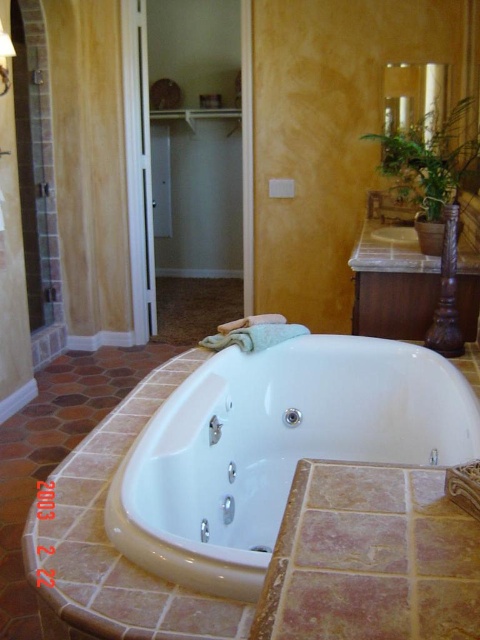
Does white glossy bathtub at center have a larger size compared to white glossy sink at center?

Yes, white glossy bathtub at center is bigger than white glossy sink at center.

Can you confirm if white glossy bathtub at center is positioned to the right of white glossy sink at center?

Incorrect, white glossy bathtub at center is not on the right side of white glossy sink at center.

Is point (148, 547) in front of point (396, 236)?

Yes.

This screenshot has height=640, width=480. I want to click on white glossy bathtub at center, so click(275, 449).